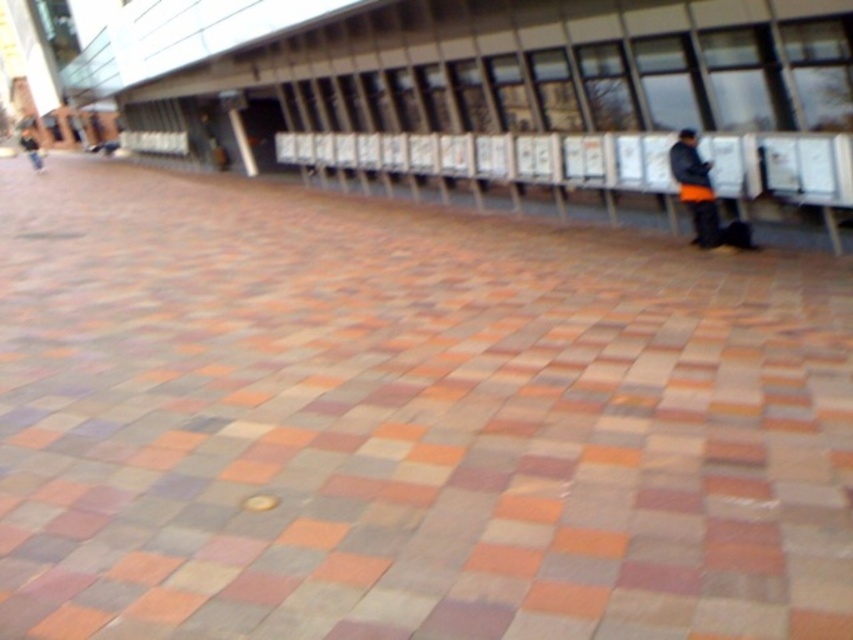
How distant is black matte jacket at right from dark blue jeans at left?

black matte jacket at right and dark blue jeans at left are 30.05 meters apart.

Which of these two, black matte jacket at right or dark blue jeans at left, stands shorter?

Standing shorter between the two is black matte jacket at right.

This screenshot has width=853, height=640. In order to click on black matte jacket at right in this screenshot , I will do `click(688, 164)`.

I want to click on black matte jacket at right, so click(x=688, y=164).

Is point (706, 205) positioned in front of point (33, 145)?

Yes.

Does orange fabric jacket at right have a greater width compared to dark blue jeans at left?

No.

Is point (683, 154) in front of point (24, 150)?

Yes, point (683, 154) is in front of point (24, 150).

This screenshot has width=853, height=640. I want to click on orange fabric jacket at right, so click(x=695, y=188).

Can you confirm if orange fabric jacket at right is positioned to the right of black matte jacket at right?

Indeed, orange fabric jacket at right is positioned on the right side of black matte jacket at right.

Between point (688, 136) and point (671, 161), which one is positioned in front?

Point (688, 136)

Image resolution: width=853 pixels, height=640 pixels. I want to click on orange fabric jacket at right, so click(695, 188).